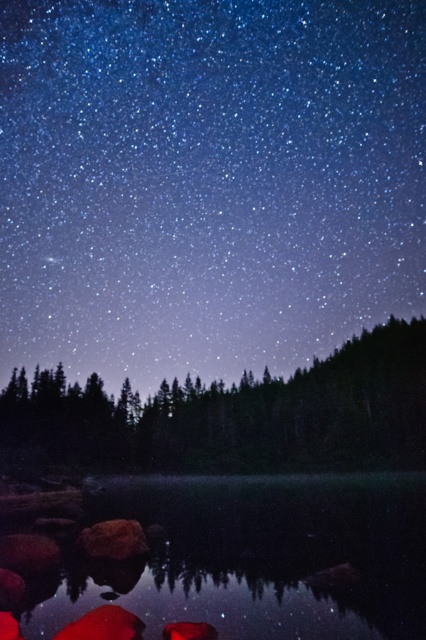
Measure the distance between transparent water at center and camera.

They are 16.49 meters apart.

Between transparent water at center and dark green textured trees at center, which one is positioned lower?

Positioned lower is dark green textured trees at center.

Measure the distance between point (419, 582) and camera.

A distance of 23.35 meters exists between point (419, 582) and camera.

You are a GUI agent. You are given a task and a screenshot of the screen. Output one action in this format:
    pyautogui.click(x=<x>, y=<y>)
    Task: Click on the transparent water at center
    Image resolution: width=426 pixels, height=640 pixels.
    Given the screenshot: What is the action you would take?
    pyautogui.click(x=253, y=557)